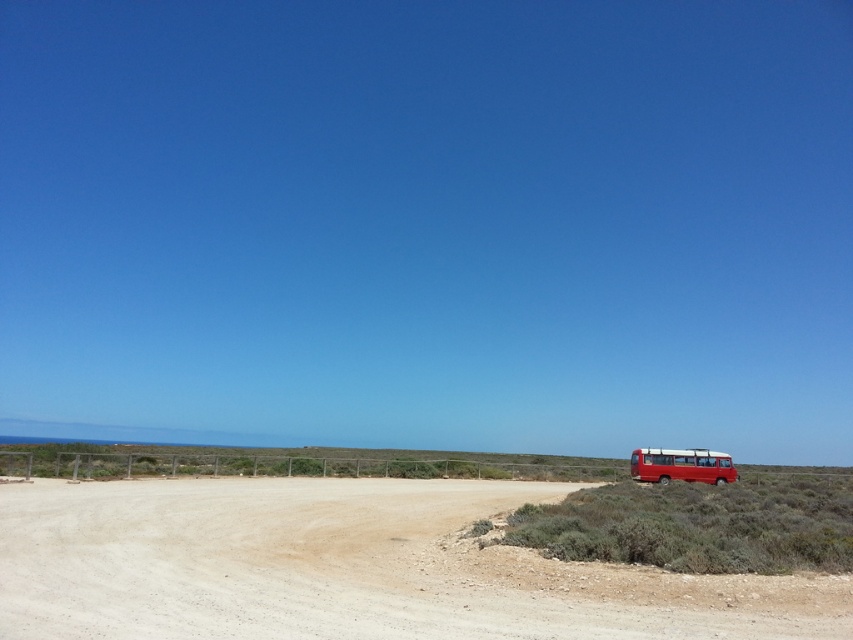
Is dirt field at lower right to the right of metallic red bus at right from the viewer's perspective?

In fact, dirt field at lower right is to the left of metallic red bus at right.

Measure the distance between point (x=567, y=484) and camera.

42.04 meters

This screenshot has width=853, height=640. I want to click on dirt field at lower right, so click(x=350, y=568).

Locate an element on the screen. Image resolution: width=853 pixels, height=640 pixels. green shrubbery at right is located at coordinates (698, 525).

Is green shrubbery at right positioned in front of metallic red bus at right?

Yes, green shrubbery at right is closer to the viewer.

What are the coordinates of `green shrubbery at right` in the screenshot? It's located at (698, 525).

Find the location of a particular element. This screenshot has height=640, width=853. green shrubbery at right is located at coordinates (698, 525).

Measure the distance from dirt field at lower right to green shrubbery at right.

dirt field at lower right is 8.86 meters from green shrubbery at right.

Who is more distant from viewer, (111, 612) or (782, 566)?

Positioned behind is point (782, 566).

The image size is (853, 640). In order to click on dirt field at lower right in this screenshot , I will do `click(350, 568)`.